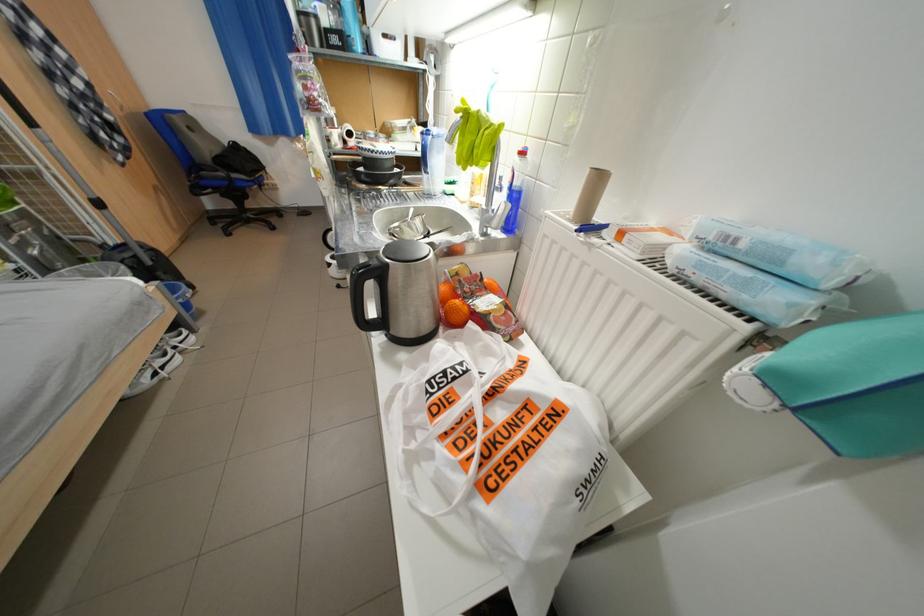
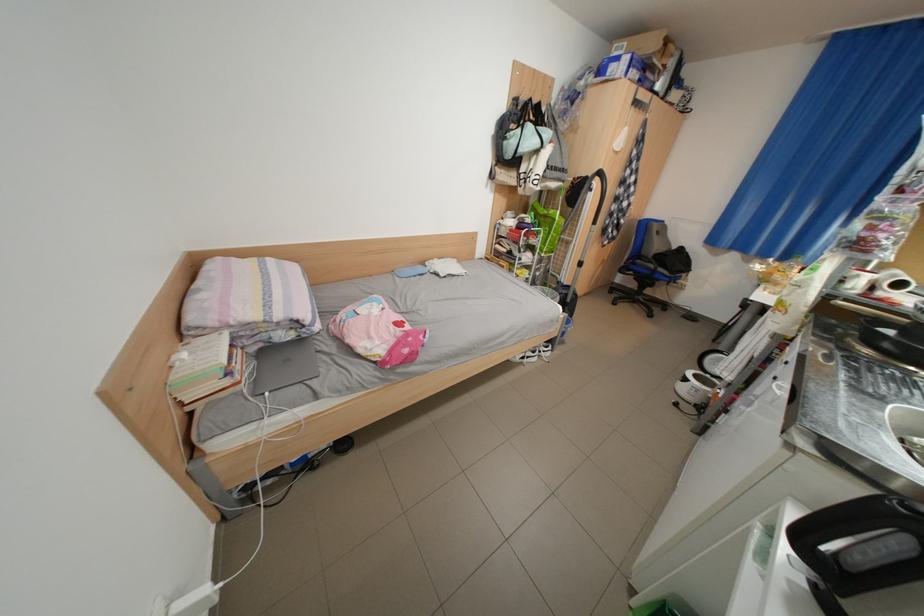
Find the pixel in the second image that matches point (213, 179) in the first image.

(646, 265)